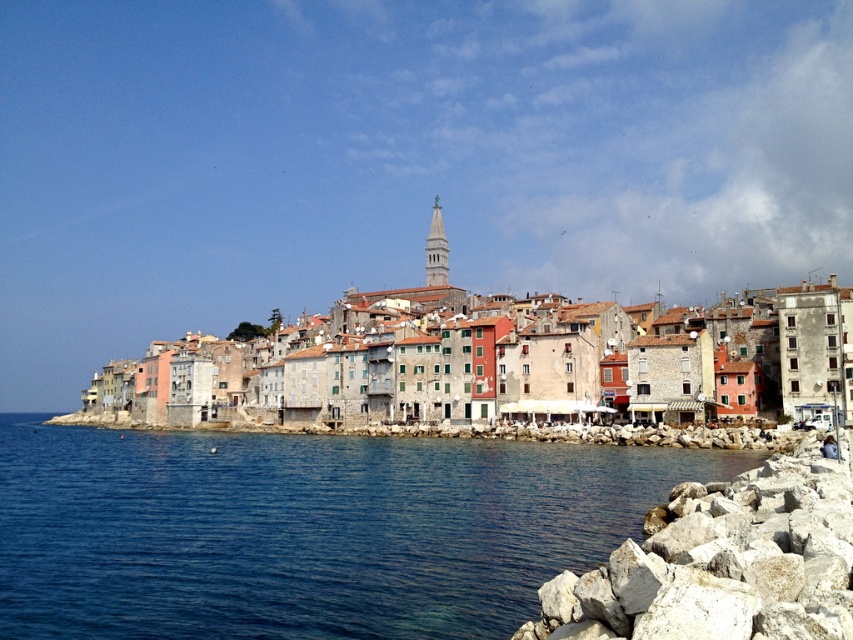
Question: In this image, where is blue water at lower left located relative to multicolored stone buildings at center?

Choices:
 (A) left
 (B) right

Answer: (A)

Question: Does blue water at lower left appear under multicolored stone buildings at center?

Choices:
 (A) no
 (B) yes

Answer: (B)

Question: Which object is the closest to the multicolored stone buildings at center?

Choices:
 (A) white rough rock at lower right
 (B) blue water at lower left

Answer: (B)

Question: Which point is farther to the camera?

Choices:
 (A) (840, 419)
 (B) (695, 600)
 (C) (302, 525)

Answer: (A)

Question: Can you confirm if blue water at lower left is positioned above multicolored stone buildings at center?

Choices:
 (A) no
 (B) yes

Answer: (A)

Question: Among these objects, which one is farthest from the camera?

Choices:
 (A) blue water at lower left
 (B) white rough rock at lower right
 (C) multicolored stone buildings at center

Answer: (C)